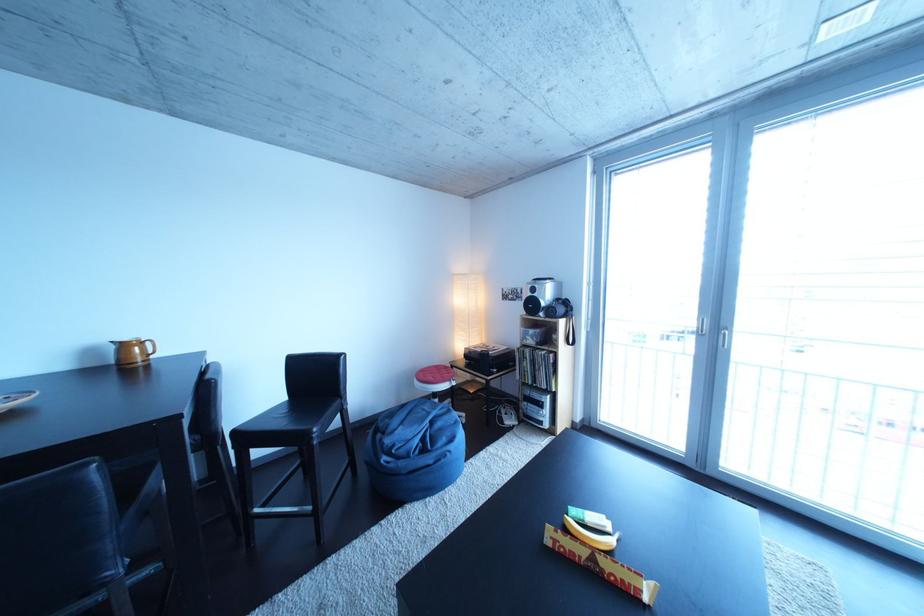
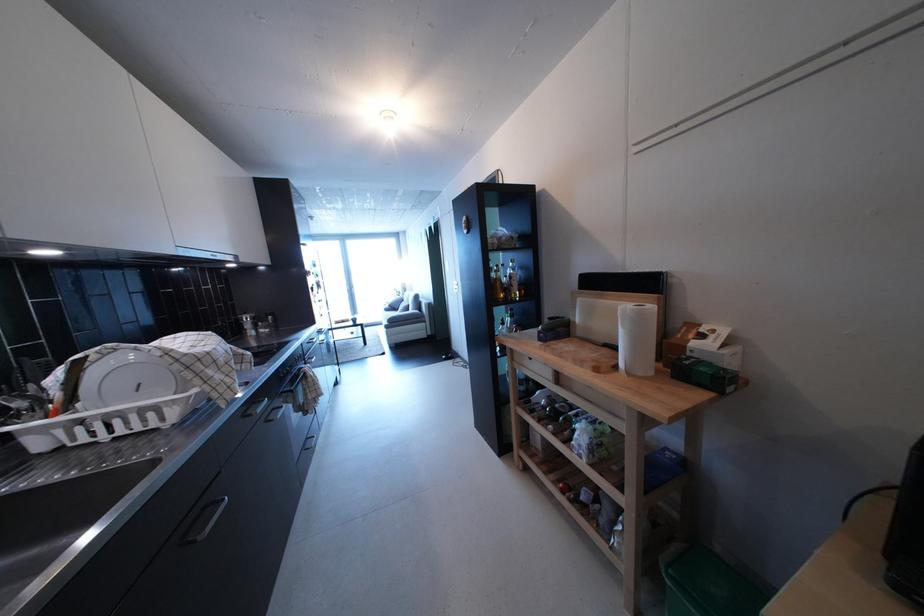
Question: I am providing you with two images of the same scene from different viewpoints. Please identify which objects are invisible in image2.

Choices:
 (A) metal cabinet knob
 (B) black cabinet handle
 (C) yellow banana
 (D) metal cooking pot

Answer: (C)